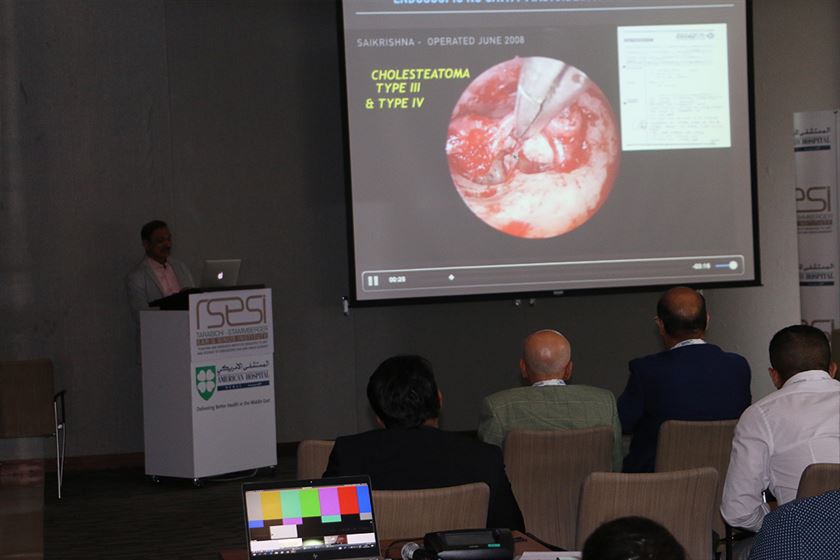
Identify the location of wall. (449, 350).